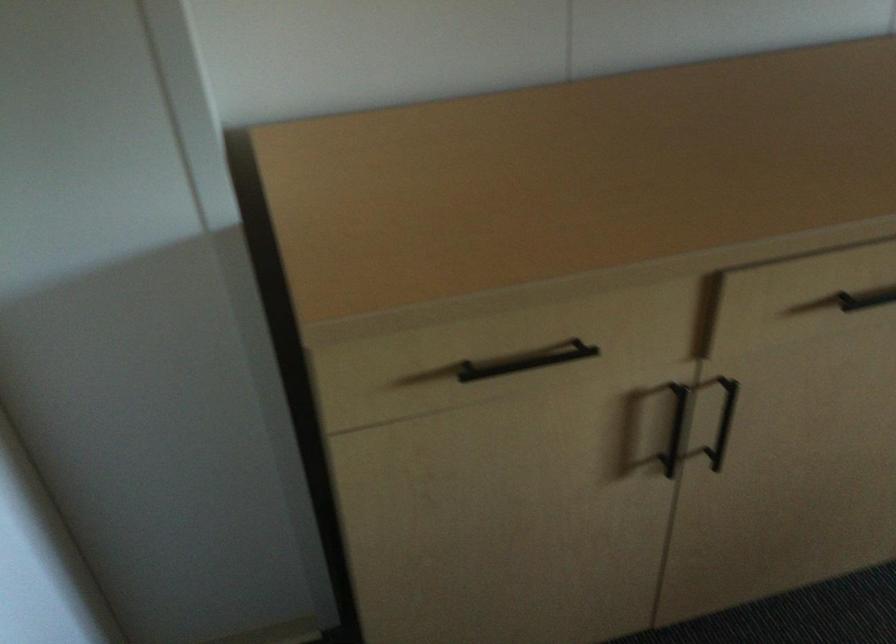
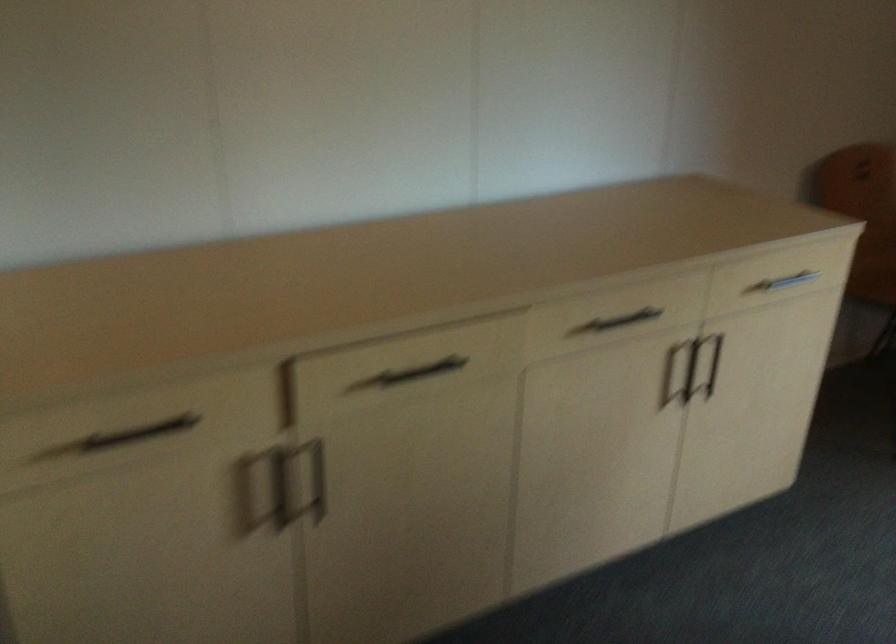
Question: The camera is either moving clockwise (left) or counter-clockwise (right) around the object. The first image is from the beginning of the video and the second image is from the end. Is the camera moving left or right when shooting the video?

Choices:
 (A) Left
 (B) Right

Answer: (A)